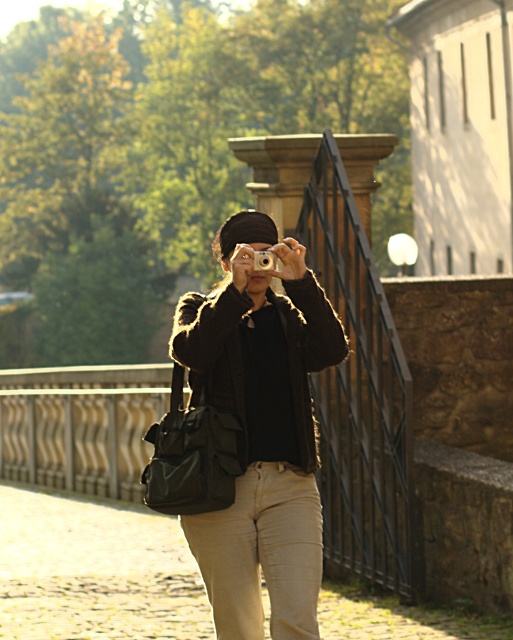
Does point (286, 632) lie in front of point (267, 252)?

Yes, point (286, 632) is closer to viewer.

Is matte black camera at center bigger than silver metallic camera at center?

Yes, matte black camera at center is bigger than silver metallic camera at center.

The height and width of the screenshot is (640, 513). What do you see at coordinates (261, 428) in the screenshot? I see `matte black camera at center` at bounding box center [261, 428].

You are a GUI agent. You are given a task and a screenshot of the screen. Output one action in this format:
    pyautogui.click(x=<x>, y=<y>)
    Task: Click on the matte black camera at center
    This screenshot has height=640, width=513.
    Given the screenshot: What is the action you would take?
    pyautogui.click(x=261, y=428)

Between khaki cotton pants at center and silver metallic camera at center, which one appears on the right side from the viewer's perspective?

From the viewer's perspective, silver metallic camera at center appears more on the right side.

Between khaki cotton pants at center and silver metallic camera at center, which one is positioned higher?

silver metallic camera at center

You are a GUI agent. You are given a task and a screenshot of the screen. Output one action in this format:
    pyautogui.click(x=<x>, y=<y>)
    Task: Click on the khaki cotton pants at center
    The image size is (513, 640).
    Given the screenshot: What is the action you would take?
    point(262,554)

From the picture: Does matte black camera at center have a smaller size compared to khaki cotton pants at center?

No, matte black camera at center is not smaller than khaki cotton pants at center.

Measure the distance between point (211, 388) and camera.

Point (211, 388) and camera are 19.65 feet apart from each other.

The height and width of the screenshot is (640, 513). I want to click on matte black camera at center, so click(261, 428).